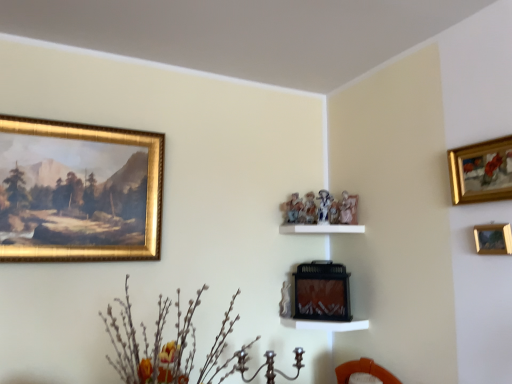
Question: Is gold-framed painting at upper right, the fourth picture frame when ordered from left to right, taller or shorter than gold-framed painting at upper left, the third picture frame viewed from the front?

Choices:
 (A) short
 (B) tall

Answer: (A)

Question: Choose the correct answer: Is gold-framed painting at upper right, the fourth picture frame when ordered from left to right, inside gold-framed painting at upper left, acting as the second picture frame starting from the back, or outside it?

Choices:
 (A) inside
 (B) outside

Answer: (B)

Question: Which of these objects is positioned farthest from the white glossy shelf at center?

Choices:
 (A) silvery metallic branches at lower left
 (B) gold-framed painting at upper left, acting as the second picture frame starting from the back
 (C) wooden picture frame at upper right, which is the 3th picture frame from back to front
 (D) gold-framed painting at upper right, the first picture frame viewed from the right
 (E) matte black fireplace at center, the 2th picture frame when ordered from left to right

Answer: (B)

Question: Considering the real-world distances, which object is closest to the gold-framed painting at upper right, positioned as the first picture frame in front-to-back order?

Choices:
 (A) gold-framed painting at upper left, the first picture frame in the left-to-right sequence
 (B) silvery metallic branches at lower left
 (C) white glossy shelf at center
 (D) matte black fireplace at center, the 3th picture frame viewed from the right
 (E) wooden picture frame at upper right, which is the 3th picture frame from back to front

Answer: (E)